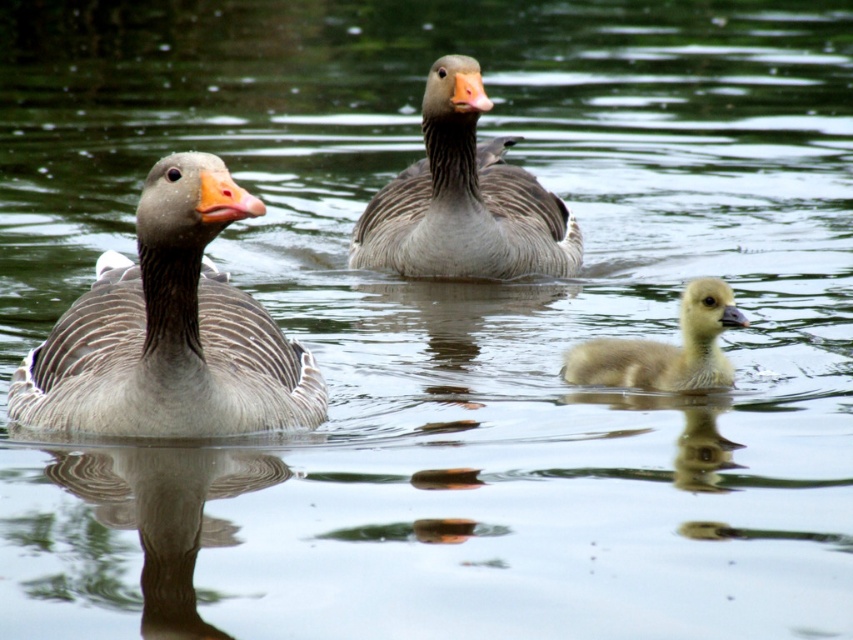
You are a birdwatcher observing the scene. You notice the gray matte duck at left and the yellow downy duckling at center. Which one has a greater height?

The gray matte duck at left is taller than the yellow downy duckling at center.

You are a photographer trying to capture the gray matte duck at center and the yellow downy duckling at center in a single frame. Given their sizes, which one will appear bigger in your photo?

The gray matte duck at center will appear bigger in the photo because its width is larger than the yellow downy duckling at center.

You are standing on the shore observing the gray matte duck at left and the yellow downy duckling at center. Which one appears bigger in size?

The gray matte duck at left is larger in size compared to the yellow downy duckling at center.